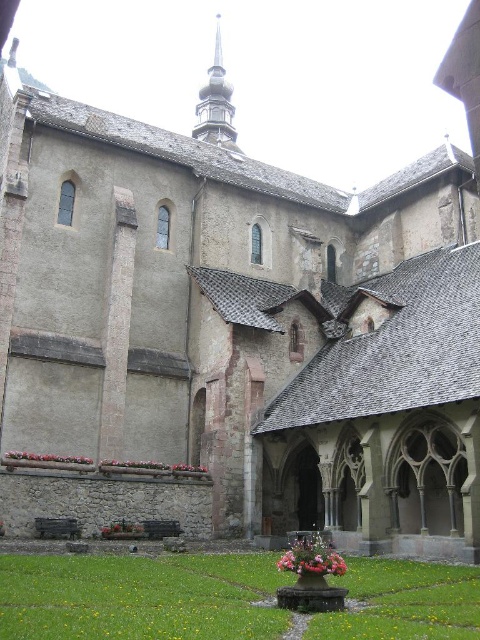
Based on the photo, you are a gardener who wants to plant a new flower in the courtyard. You have two options from the image, the pink floral bouquet at center and the pink fabric flower at lower center. Which one is wider and better suited for a space that requires a broader spread?

The pink fabric flower at lower center is wider than the pink floral bouquet at center, making it better suited for a space that requires a broader spread.

You are an architect visiting the courtyard and want to place a new statue between the smooth gold spire at upper center and the pink floral bouquet at center. Based on their positions, which object should the statue be closer to?

The smooth gold spire at upper center is positioned on the left side of the pink floral bouquet at center, so the statue should be placed closer to the smooth gold spire at upper center to maintain symmetry.

You are an architect visiting the courtyard and want to compare the height of the smooth gold spire at upper center and the pink fabric flower at lower center. Which object is taller?

The smooth gold spire at upper center is much taller than the pink fabric flower at lower center.